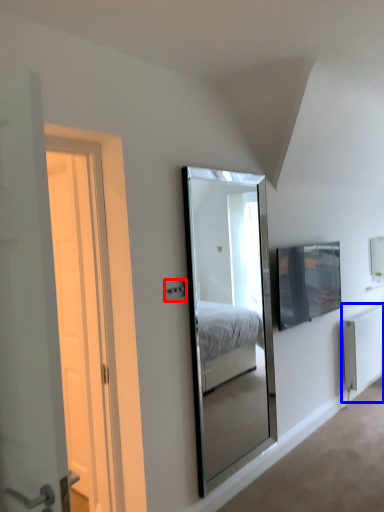
Question: Which object is closer to the camera taking this photo, electric outlet (highlighted by a red box) or radiator (highlighted by a blue box)?

Choices:
 (A) electric outlet
 (B) radiator

Answer: (A)